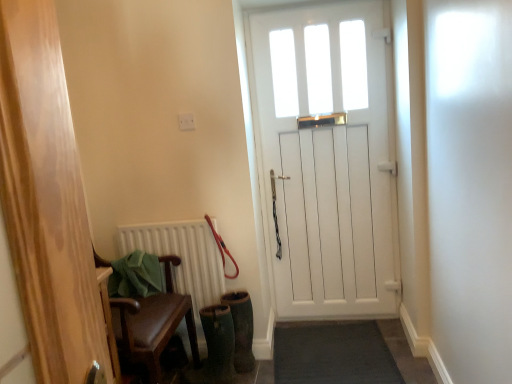
Image resolution: width=512 pixels, height=384 pixels. What are the coordinates of `free area in between white wooden door at center and dark gray carpet at lower center` in the screenshot? It's located at (398, 348).